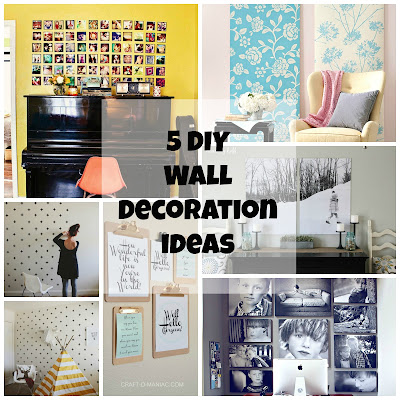
Find the location of a particular element. The image size is (400, 400). black piano is located at coordinates (69, 120).